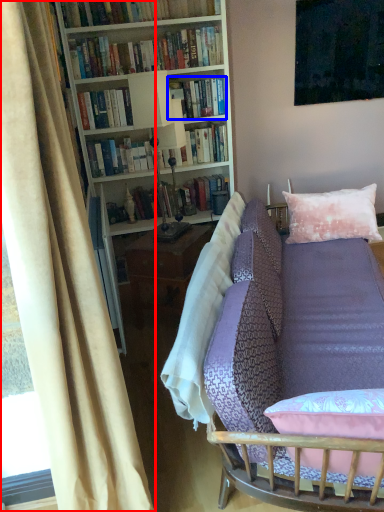
Question: Which of the following is the closest to the observer, curtain (highlighted by a red box) or book (highlighted by a blue box)?

Choices:
 (A) curtain
 (B) book

Answer: (A)